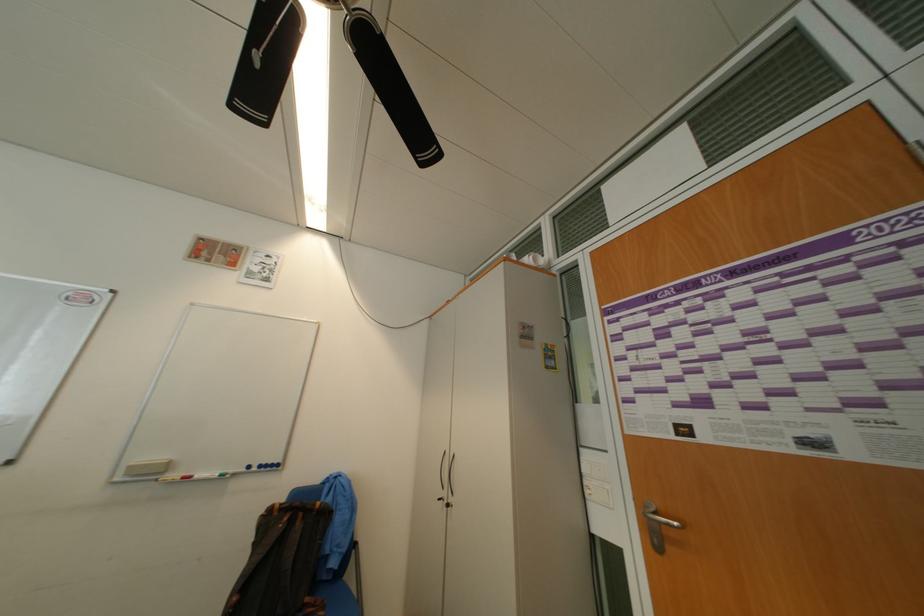
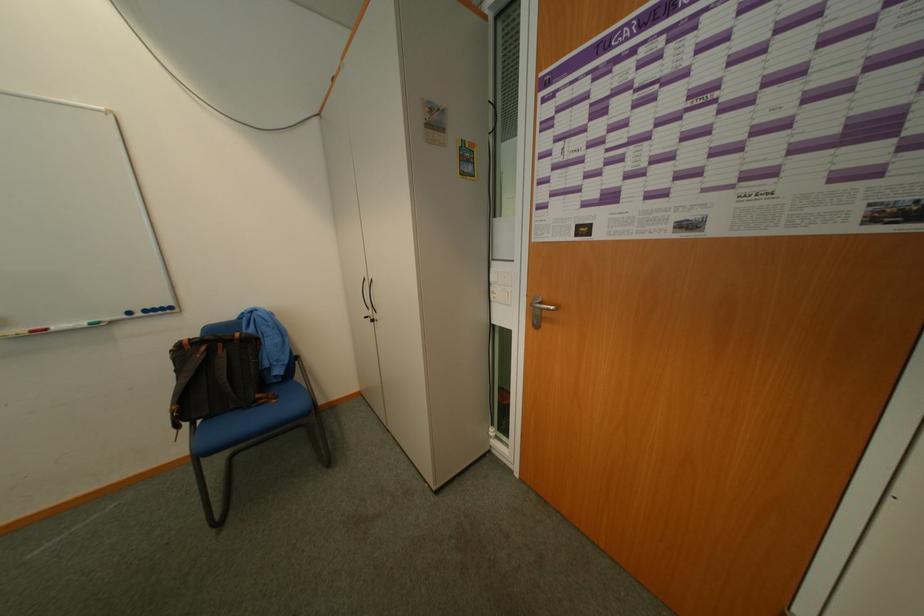
Question: The first image is from the beginning of the video and the second image is from the end. How did the camera likely rotate when shooting the video?

Choices:
 (A) Left
 (B) Right
 (C) Up
 (D) Down

Answer: (D)